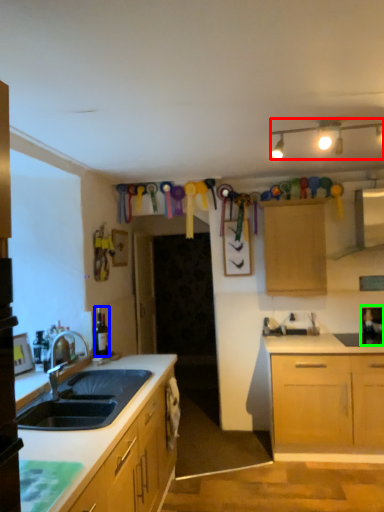
Question: Considering the real-world distances, which object is farthest from lamp (highlighted by a red box)? bottle (highlighted by a blue box) or appliance (highlighted by a green box)?

Choices:
 (A) bottle
 (B) appliance

Answer: (A)